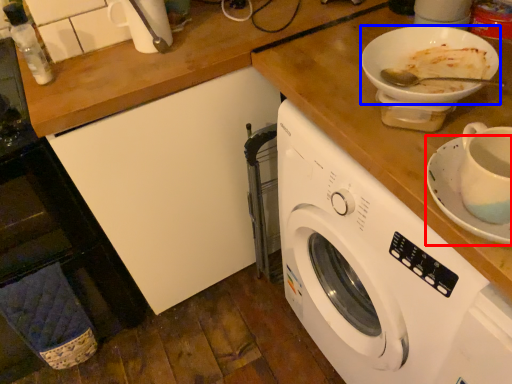
Question: Which object appears farthest to the camera in this image, saucer (highlighted by a red box) or tableware (highlighted by a blue box)?

Choices:
 (A) saucer
 (B) tableware

Answer: (B)